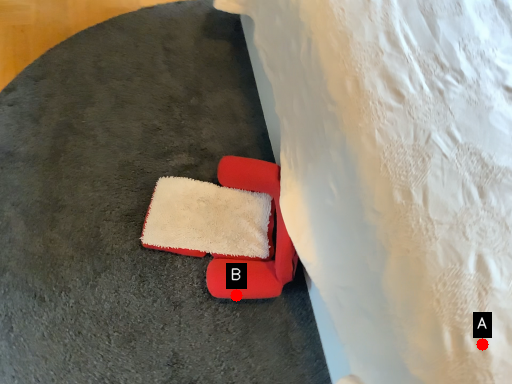
Question: Two points are circled on the image, labeled by A and B beside each circle. Which point appears closest to the camera in this image?

Choices:
 (A) A is closer
 (B) B is closer

Answer: (A)